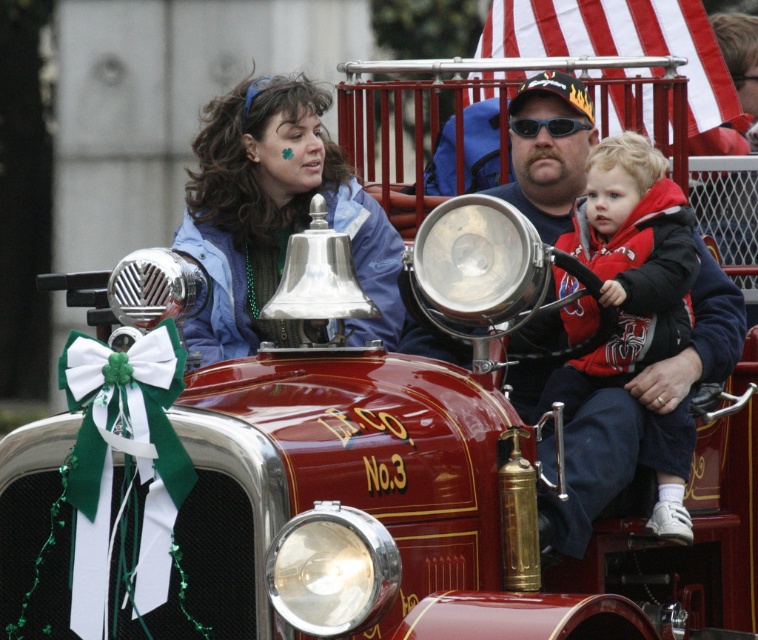
You are organizing a St. Patrick Day parade and need to decide which jacket to use for the mascot costume. The mascot costume requires a jacket that can fit over a thick mascot suit. Which jacket between the blue fleece jacket at center and the red fleece jacket at center would you choose and why?

The blue fleece jacket at center has a larger size compared to the red fleece jacket at center, so it would be better to choose the blue fleece jacket at center as it can accommodate the thick mascot suit.

You are a participant in a St. Patrick Day parade and see both the blue fleece jacket at center and the red fleece jacket at center. Which jacket is covering the other one?

The blue fleece jacket at center is positioned over the red fleece jacket at center, so it is covering the red one.

Consider the image. You are a photographer standing in front of the vintage fire truck. You notice the blue fleece jacket at center. Where exactly is the blue fleece jacket positioned relative to the fire truck?

The blue fleece jacket at center is located at point 0.333 along the horizontal axis and 0.363 along the vertical axis relative to the fire truck.